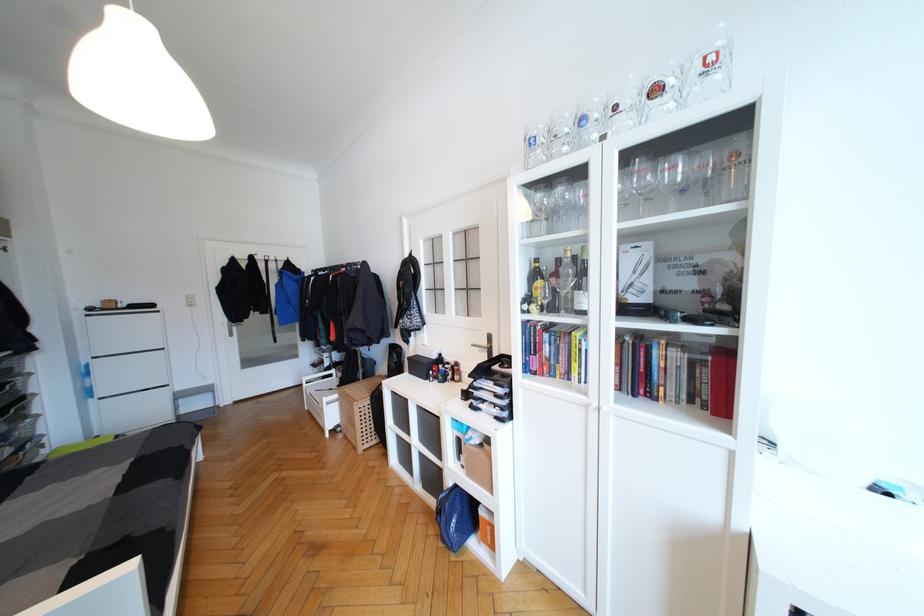
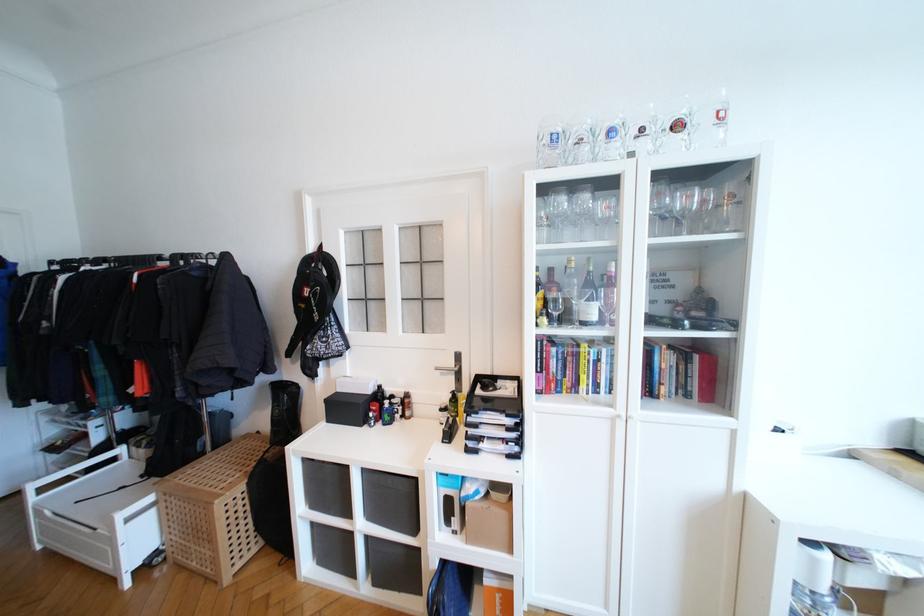
Find the pixel in the second image that matches point 549,302 in the first image.

(558, 315)